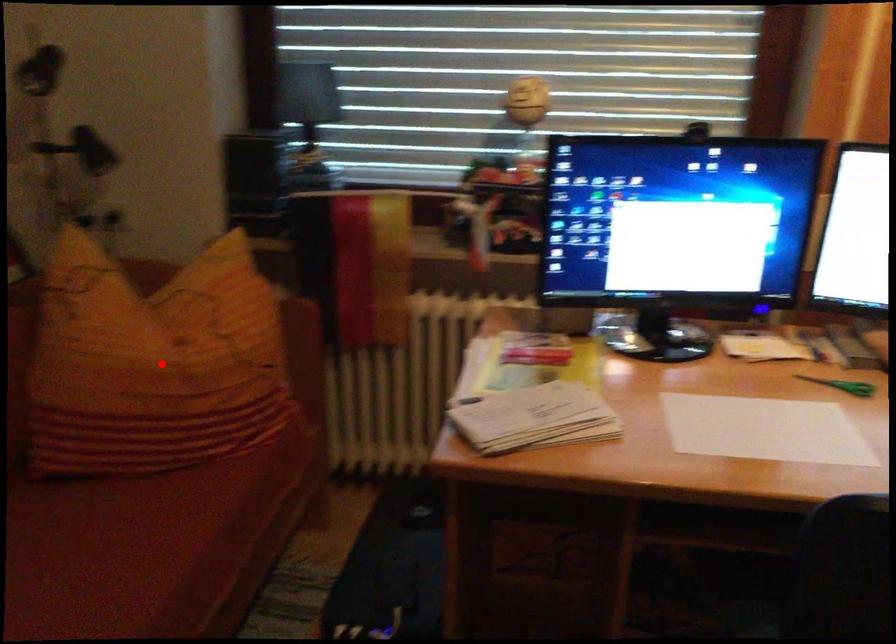
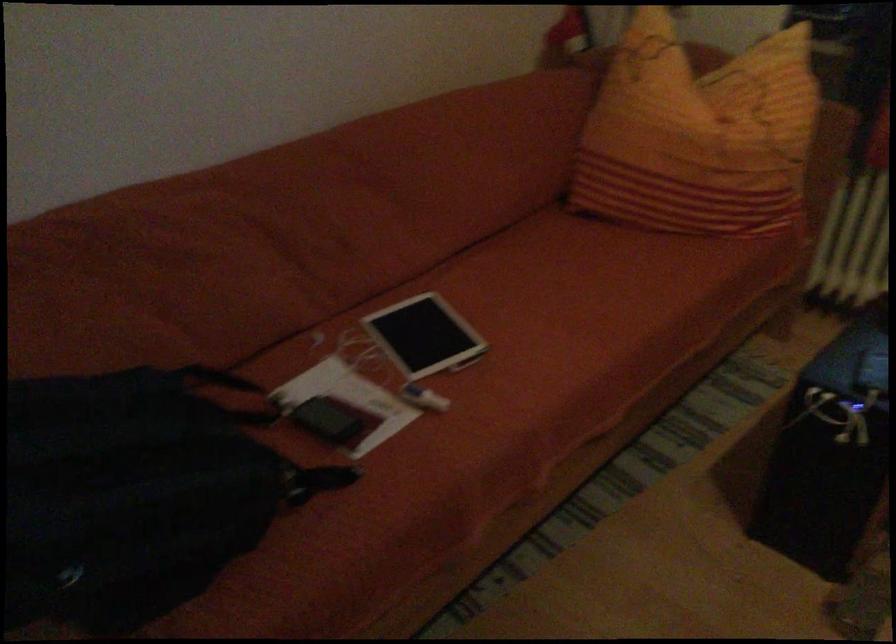
In the second image, find the point that corresponds to the highlighted location in the first image.

(698, 135)